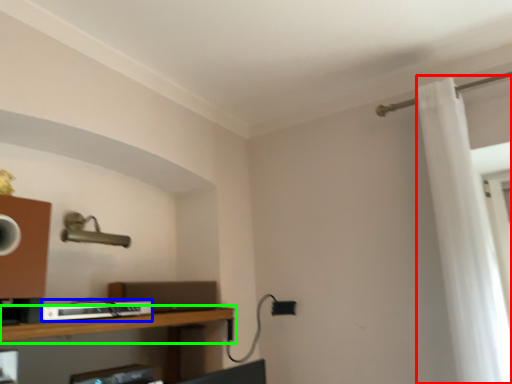
Question: Which object is positioned farthest from shower curtain (highlighted by a red box)? Select from equipment (highlighted by a blue box) and shelf (highlighted by a green box).

Choices:
 (A) equipment
 (B) shelf

Answer: (A)